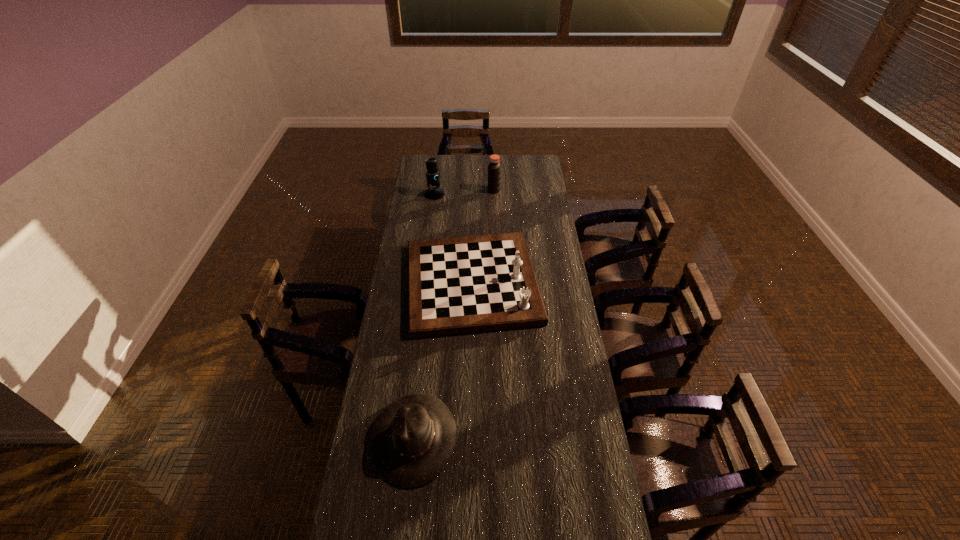
I want to click on gameboard that is positioned at the left edge, so click(x=456, y=285).

In order to click on hat at the left edge in this screenshot , I will do `click(412, 440)`.

Where is `object at the right edge`? object at the right edge is located at coordinates (456, 285).

The image size is (960, 540). In order to click on blank space at the far edge of the desktop in this screenshot , I will do `click(468, 157)`.

In the image, there is a desktop. At what (x,y) coordinates should I click in order to perform the action: click on vacant space at the left edge. Please return your answer as a coordinate pair (x, y). The height and width of the screenshot is (540, 960). Looking at the image, I should click on (417, 183).

This screenshot has width=960, height=540. I want to click on vacant point at the right edge, so click(x=585, y=416).

Locate which object ranks third in proximity to the vinegar. Please provide its 2D coordinates. Your answer should be formatted as a tuple, i.e. [(x, y)], where the tuple contains the x and y coordinates of a point satisfying the conditions above.

[(412, 440)]

Locate an element on the screen. The width and height of the screenshot is (960, 540). object that stands as the third closest to the second nearest object is located at coordinates (494, 167).